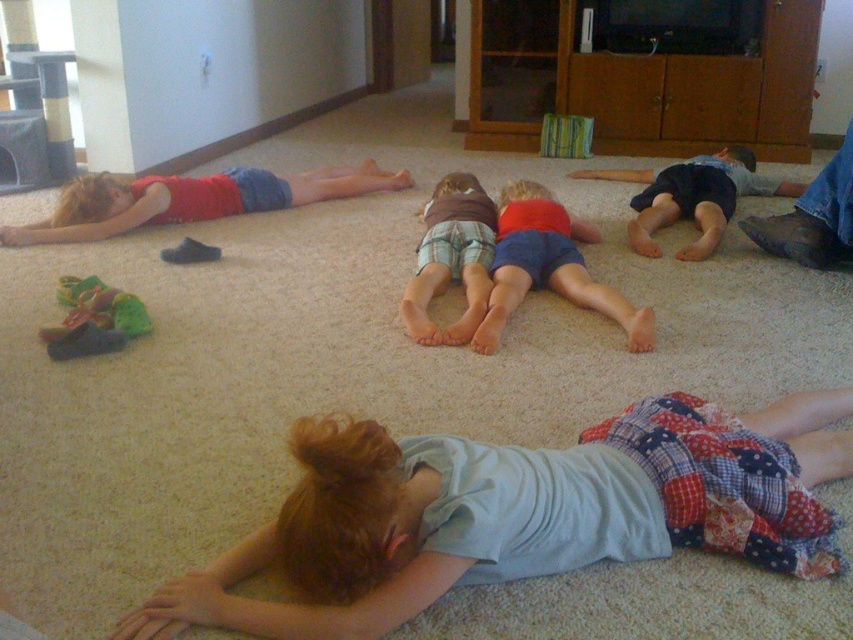
Can you confirm if red cotton shorts at center is smaller than brown plaid shorts at center?

No.

Between red cotton shorts at center and brown plaid shorts at center, which one has more height?

brown plaid shorts at center is taller.

Is point (515, 288) farther from viewer compared to point (479, 227)?

No, it is in front of (479, 227).

At what (x,y) coordinates should I click in order to perform the action: click on red cotton shorts at center. Please return your answer as a coordinate pair (x, y). This screenshot has width=853, height=640. Looking at the image, I should click on (548, 266).

Who is positioned more to the left, matte red shirt at left or brown plaid shorts at center?

Positioned to the left is matte red shirt at left.

Between matte red shirt at left and brown plaid shorts at center, which one appears on the right side from the viewer's perspective?

Positioned to the right is brown plaid shorts at center.

Between point (131, 220) and point (469, 314), which one is positioned behind?

Point (131, 220)

This screenshot has width=853, height=640. In order to click on matte red shirt at left in this screenshot , I will do `click(190, 198)`.

Does red cotton shorts at center have a greater width compared to dark blue shorts at right?

No.

Does red cotton shorts at center have a larger size compared to dark blue shorts at right?

Incorrect, red cotton shorts at center is not larger than dark blue shorts at right.

Which is in front, point (502, 273) or point (639, 212)?

Positioned in front is point (502, 273).

Find the location of a particular element. red cotton shorts at center is located at coordinates pyautogui.click(x=548, y=266).